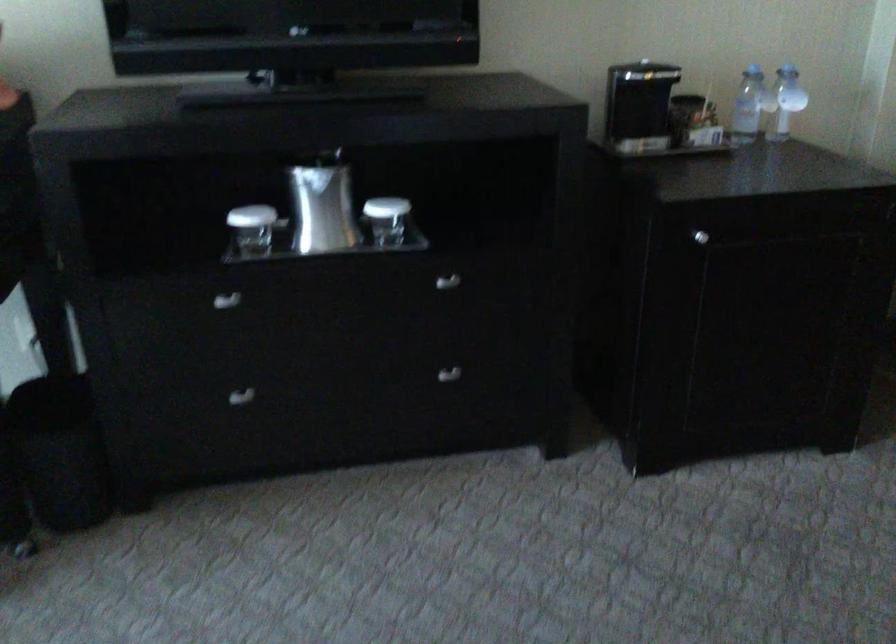
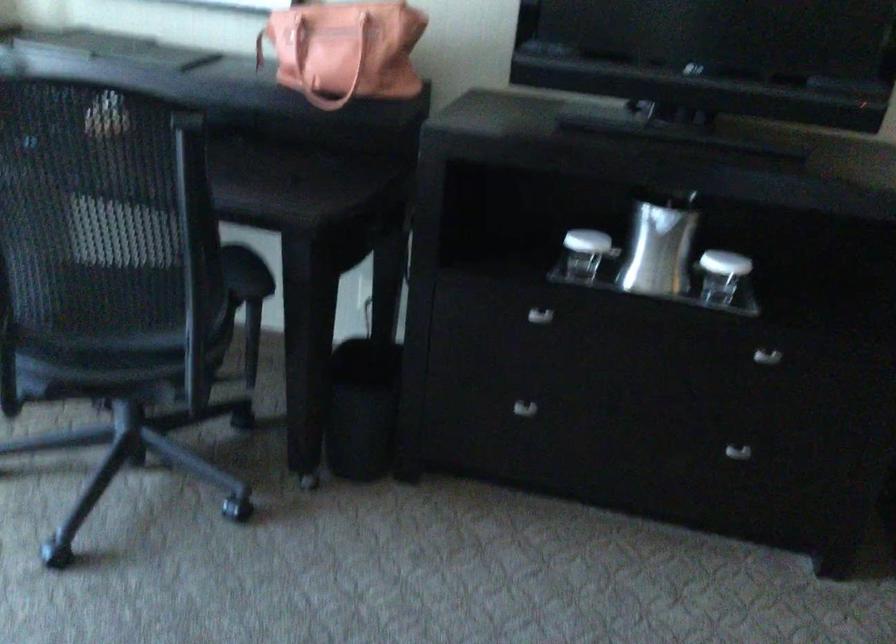
Where in the second image is the point corresponding to point (444, 281) from the first image?

(767, 357)